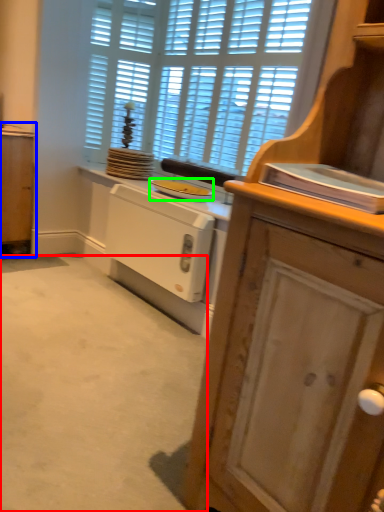
Question: Considering the real-world distances, which object is closest to plain (highlighted by a red box)? cabinetry (highlighted by a blue box) or appliance (highlighted by a green box).

Choices:
 (A) cabinetry
 (B) appliance

Answer: (B)